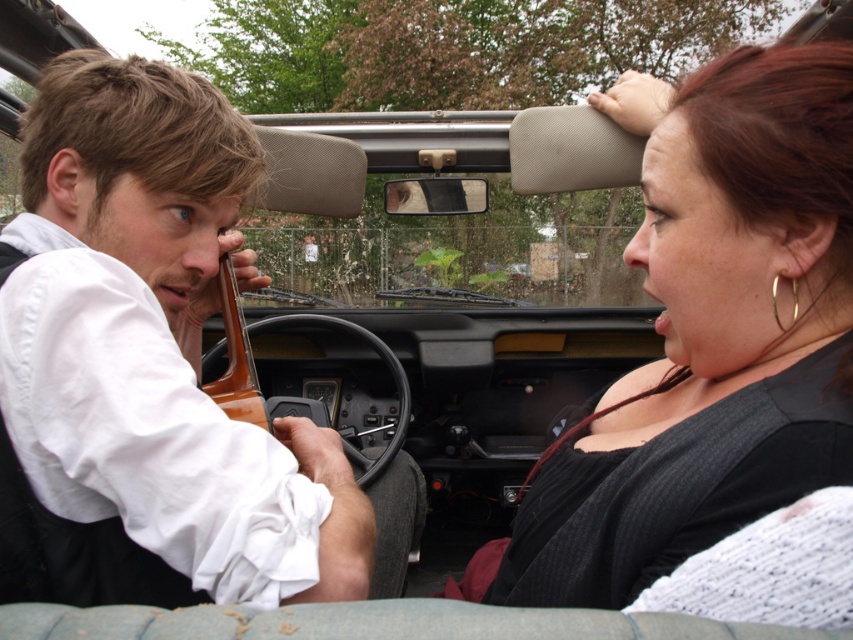
You are a photographer trying to capture the wooden violin at left in the center of your photo. The photo frame is a square with coordinates from 0 to 1 on both axes. Can you position the violin so that its center aligns with the point 0.5, 0.5?

The wooden violin at left is currently located at point [161,365]. To center it at [426,320], you would need to move it slightly to the left and upwards. However, since the violin is part of the scene as described, its position cannot be altered. Therefore, it cannot be centered at [426,320].

You are a photographer trying to capture a closeup of the wooden violin at left and the dark gray ribbed sweater at upper right. Which object should you focus on first to ensure it appears sharp in the photo?

The wooden violin at left is closer to the viewer than the dark gray ribbed sweater at upper right, so you should focus on the wooden violin at left first to ensure it appears sharp in the photo.

You are a photographer trying to capture both the wooden violin at left and the dark gray ribbed sweater at upper right in the same frame. Given their sizes, which object should you focus on to ensure both fit clearly in the photo?

→ The wooden violin at left is bigger than the dark gray ribbed sweater at upper right, so you should focus on the wooden violin at left to ensure both fit clearly in the photo.